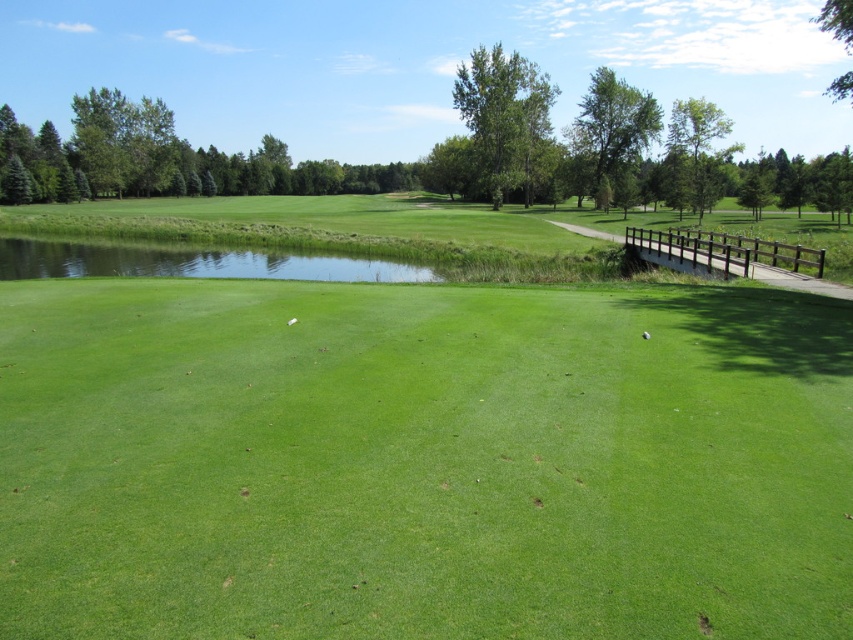
Question: Which of the following is the farthest from the observer?

Choices:
 (A) (573, 364)
 (B) (379, 276)
 (C) (643, 332)

Answer: (B)

Question: Which point appears farthest from the camera in this image?

Choices:
 (A) (148, 259)
 (B) (432, 593)
 (C) (646, 337)

Answer: (A)

Question: Which object is the farthest from the green smooth golf ball at center?

Choices:
 (A) green grassy golf course at center
 (B) clear water at center

Answer: (B)

Question: Does green grassy golf course at center appear over green smooth golf ball at center?

Choices:
 (A) yes
 (B) no

Answer: (A)

Question: Does green grassy golf course at center come behind green smooth golf ball at center?

Choices:
 (A) no
 (B) yes

Answer: (A)

Question: Does clear water at center have a larger size compared to green smooth golf ball at center?

Choices:
 (A) yes
 (B) no

Answer: (A)